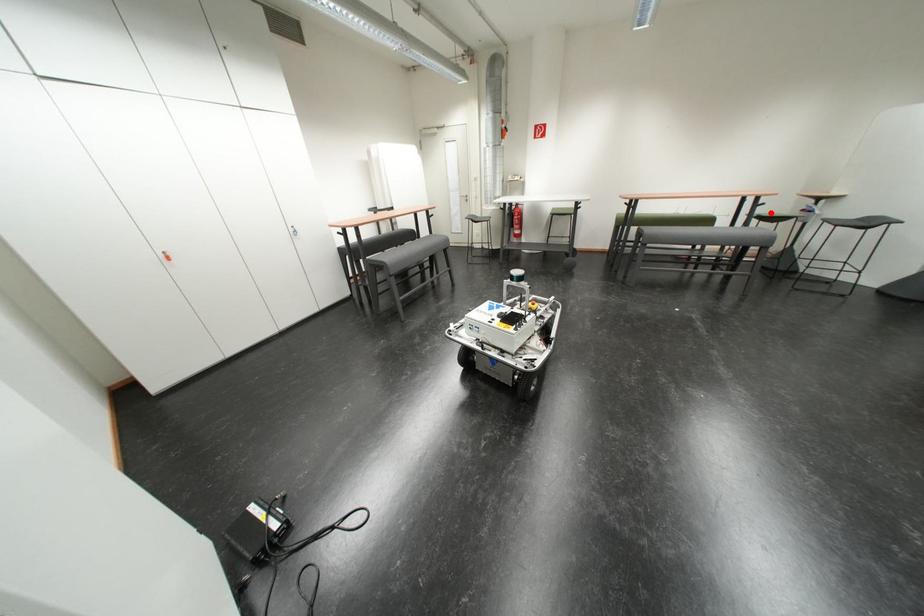
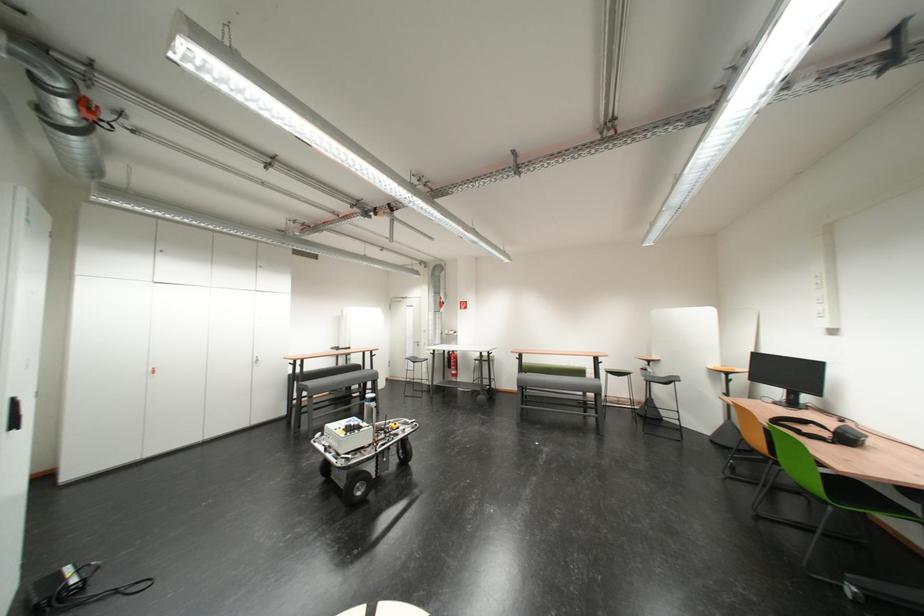
The point at the highlighted location is marked in the first image. Where is the corresponding point in the second image?

(614, 369)